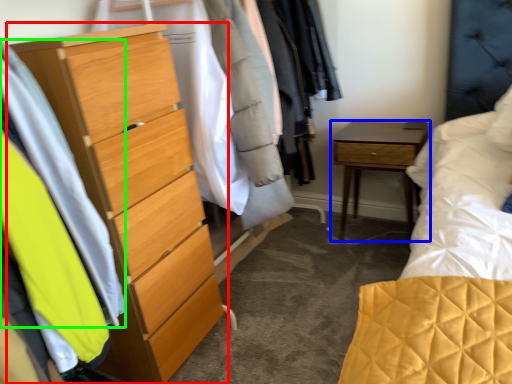
Question: Which object is positioned closest to chest of drawers (highlighted by a red box)? Select from nightstand (highlighted by a blue box) and clothing (highlighted by a green box).

Choices:
 (A) nightstand
 (B) clothing

Answer: (B)